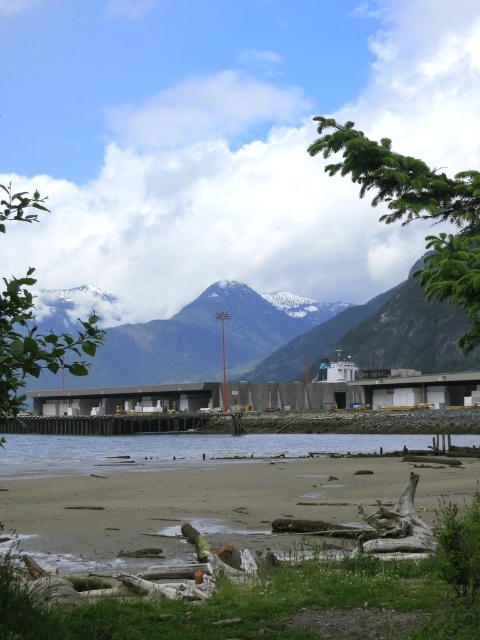
You are standing on the beach and want to take a photo of both the green leafy tree at upper right and the clear water at lower center. Which object should you point your camera towards first to include both in the frame?

You should point your camera towards the green leafy tree at upper right first because it is above the clear water at lower center, so adjusting the angle to include both would start with framing the higher object.

You are standing on the sandy beach at lower center and want to reach the clear water at lower center. Based on the scene description, which direction should you move to get to the water?

The sandy beach at lower center is much taller than the clear water at lower center, so you should move downward to reach the water.

You are a photographer planning to capture the coastal scene. You want to ensure both the sandy beach at lower center and the clear water at lower center are visible in your shot. Which object should you focus on to include both in the frame?

Answer: Since the sandy beach at lower center is bigger than the clear water at lower center, focusing on the sandy beach at lower center will help include both objects in the frame as it occupies more space in the scene.